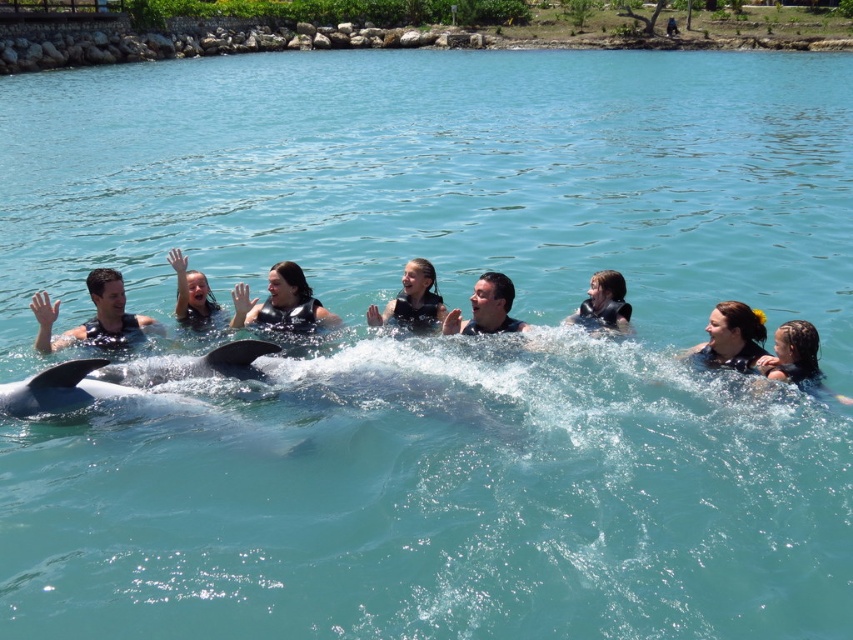
Question: Does matte black swimwear at left appear over matte black swim cap at center?

Choices:
 (A) yes
 (B) no

Answer: (B)

Question: Estimate the real-world distances between objects in this image. Which object is closer to the black smooth whale at center?

Choices:
 (A) dark brown hair at lower right
 (B) matte black swimwear at left

Answer: (B)

Question: Can you confirm if black matte life vest at center is smaller than dark brown hair at lower right?

Choices:
 (A) no
 (B) yes

Answer: (A)

Question: Which object is closer to the camera taking this photo?

Choices:
 (A) smooth skin woman at center
 (B) black matte life vest at center

Answer: (A)

Question: Which of the following is the farthest from the observer?

Choices:
 (A) (180, 266)
 (B) (105, 340)
 (C) (442, 307)
 (D) (810, 355)

Answer: (C)

Question: In this image, where is smooth skin woman at center located relative to dark brown hair at lower right?

Choices:
 (A) left
 (B) right

Answer: (A)